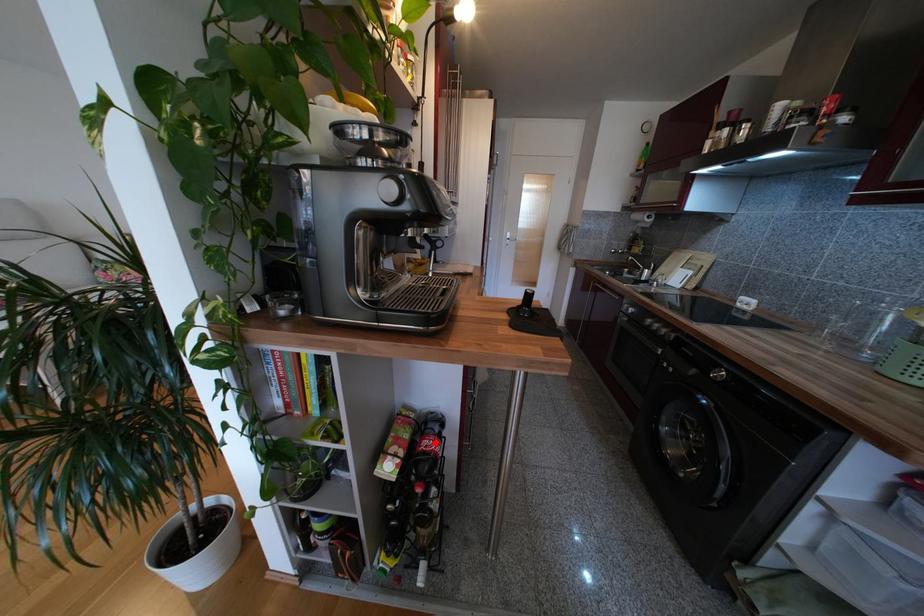
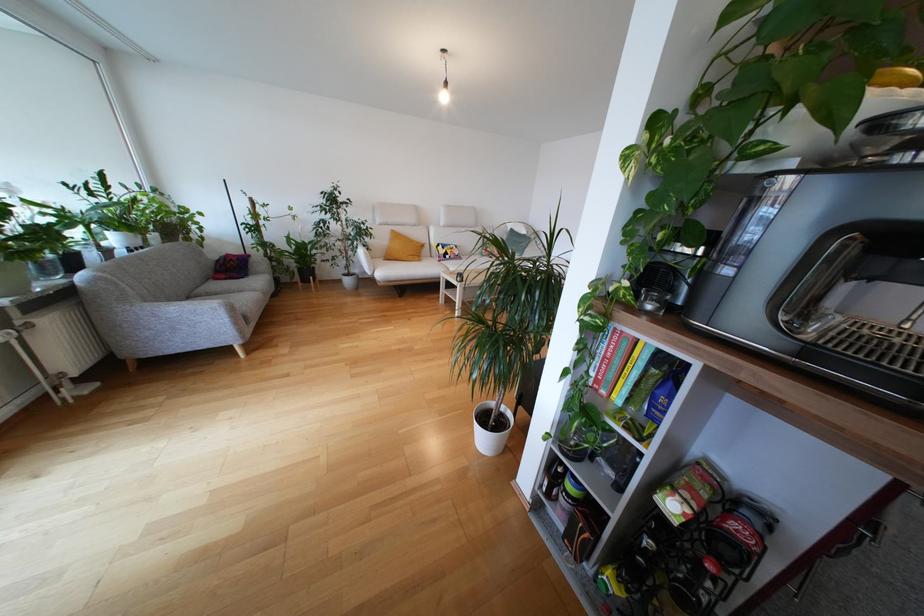
Question: I am providing you with two images of the same scene from different viewpoints. In image1, a red point is highlighted. Considering the same 3D point in image2, which of the following is correct?

Choices:
 (A) It is closer
 (B) It is farther

Answer: (A)